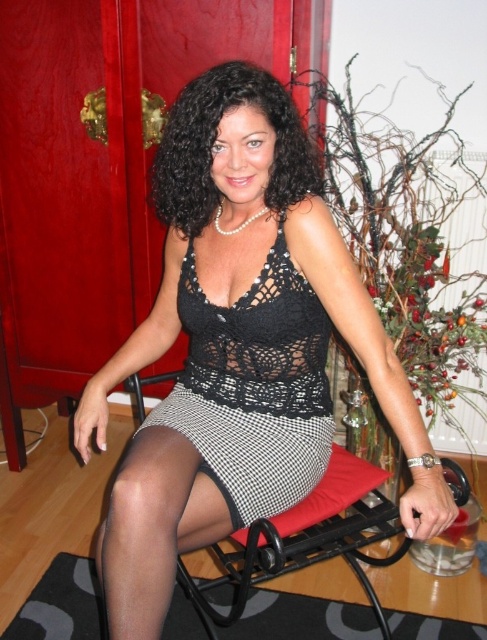
You are a photographer setting up for a portrait. You need to ensure that the subject, the woman in the image, is framed such that both the black curly hair at center and the black houndstooth skirt at center are clearly visible. Given their sizes, which object should you focus on to ensure both are in frame?

The black curly hair at center is narrower than the black houndstooth skirt at center. To ensure both are in frame, focus on the wider object, which is the black houndstooth skirt at center, as it requires more space in the composition.